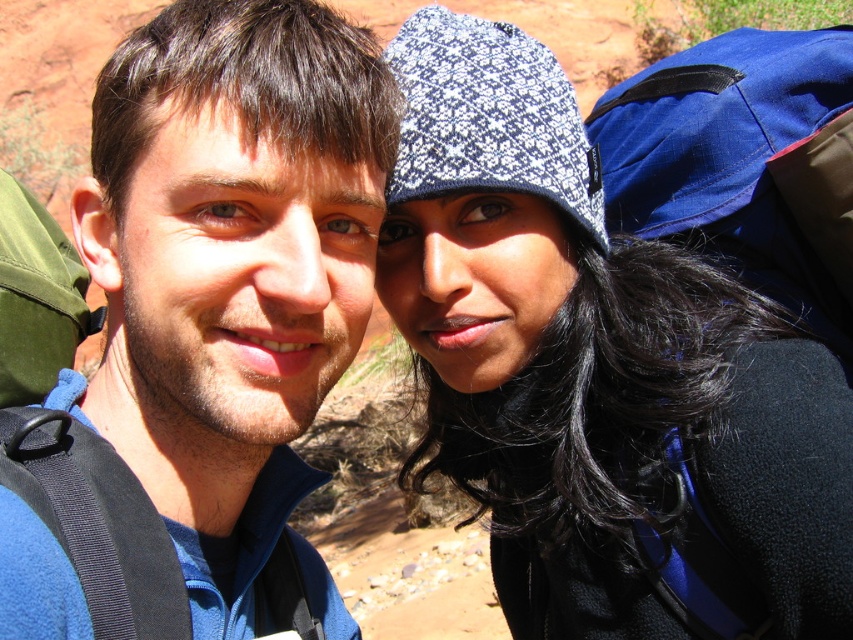
Question: Is blue fleece jacket at left above blue ripstop backpack at upper right?

Choices:
 (A) yes
 (B) no

Answer: (B)

Question: Which object appears farthest from the camera in this image?

Choices:
 (A) blue fleece jacket at left
 (B) blue ripstop backpack at upper right

Answer: (B)

Question: Can you confirm if blue fleece jacket at left is positioned above blue ripstop backpack at upper right?

Choices:
 (A) yes
 (B) no

Answer: (B)

Question: Can you confirm if blue fleece jacket at left is positioned to the left of blue ripstop backpack at upper right?

Choices:
 (A) yes
 (B) no

Answer: (A)